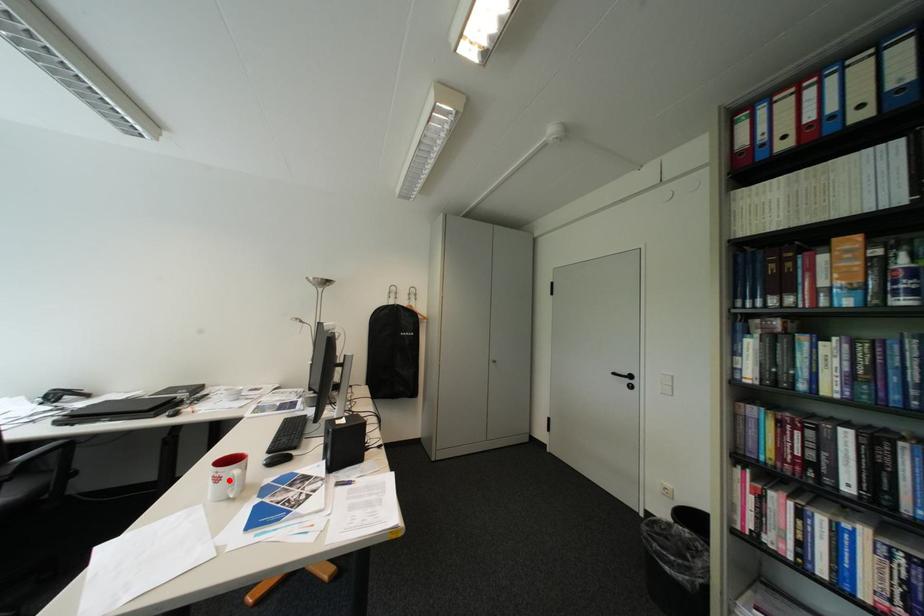
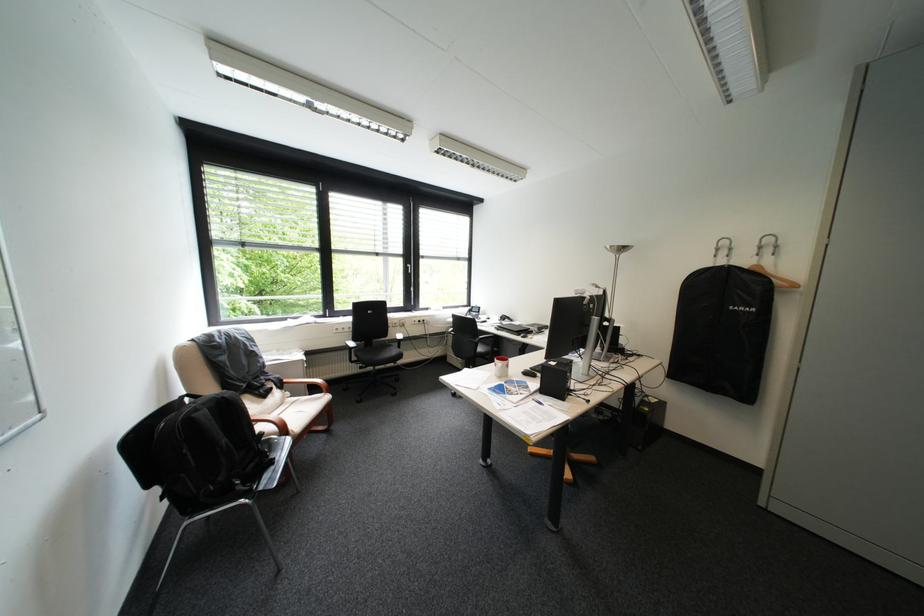
Question: I am providing you with two images of the same scene from different viewpoints. Given a red point in image1, look at the same physical point in image2. Is it:

Choices:
 (A) Closer to the viewpoint
 (B) Farther from the viewpoint

Answer: (A)